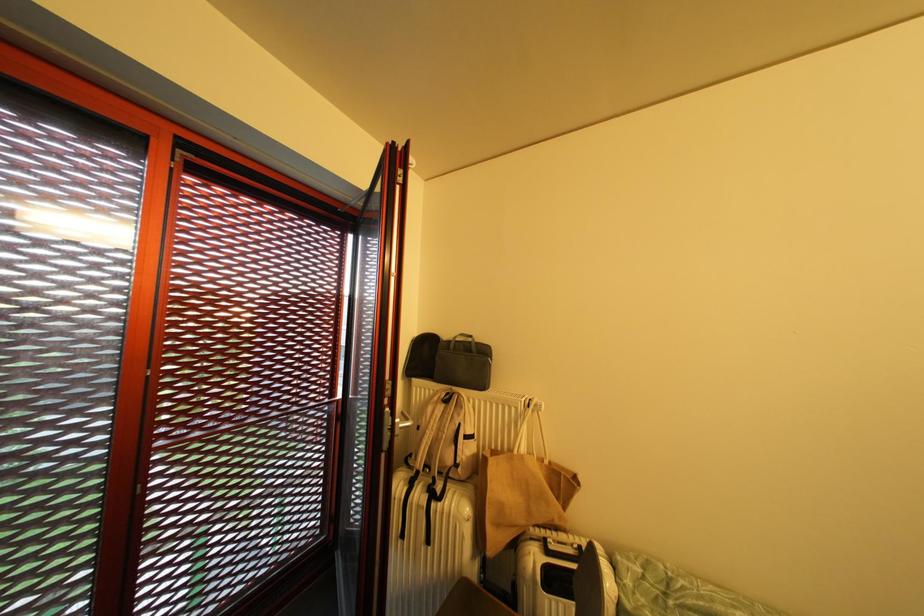
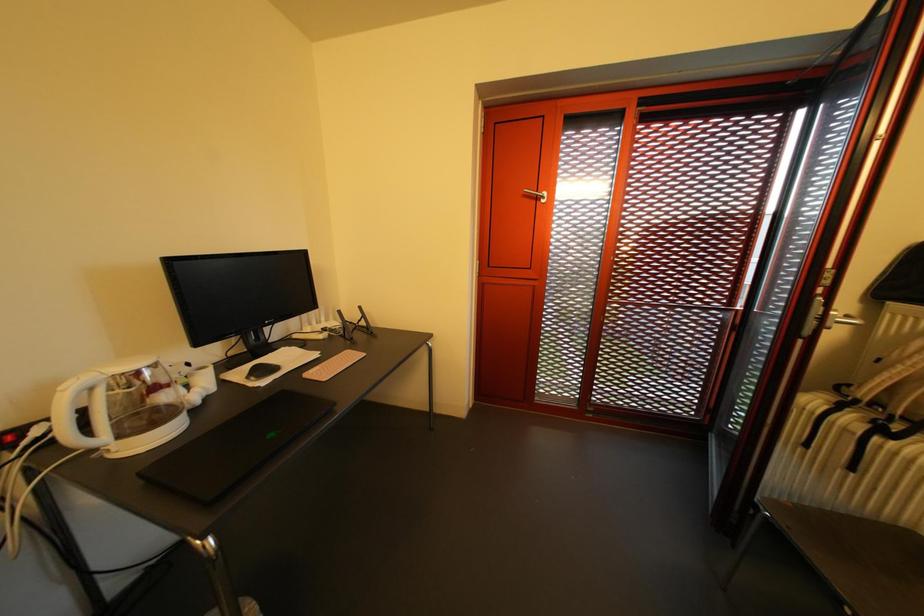
Question: The camera is either moving clockwise (left) or counter-clockwise (right) around the object. The first image is from the beginning of the video and the second image is from the end. Is the camera moving left or right when shooting the video?

Choices:
 (A) Left
 (B) Right

Answer: (B)